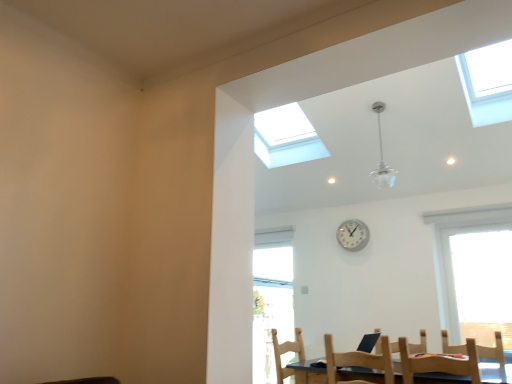
Question: From a real-world perspective, is wooden chair at lower right, positioned as the second chair in right-to-left order, located higher than white plastic clock at center?

Choices:
 (A) yes
 (B) no

Answer: (B)

Question: From the image's perspective, would you say wooden chair at lower right, acting as the second chair starting from the left, is positioned over white plastic clock at center?

Choices:
 (A) yes
 (B) no

Answer: (B)

Question: Is white plastic clock at center located within wooden chair at lower right, positioned as the second chair in right-to-left order?

Choices:
 (A) yes
 (B) no

Answer: (B)

Question: From the image's perspective, would you say wooden chair at lower right, acting as the second chair starting from the left, is shown under white plastic clock at center?

Choices:
 (A) no
 (B) yes

Answer: (B)

Question: Is wooden chair at lower right, positioned as the second chair in right-to-left order, closer to camera compared to white plastic clock at center?

Choices:
 (A) no
 (B) yes

Answer: (B)

Question: Is wooden chair at lower right, acting as the second chair starting from the left, smaller than white plastic clock at center?

Choices:
 (A) yes
 (B) no

Answer: (B)

Question: From the image's perspective, is wooden chair at lower right, acting as the first chair starting from the right, below transparent glass window at upper right, the second window from the back?

Choices:
 (A) yes
 (B) no

Answer: (A)

Question: Is wooden chair at lower right, acting as the first chair starting from the right, oriented towards transparent glass window at upper right, which ranks as the second window in left-to-right order?

Choices:
 (A) yes
 (B) no

Answer: (B)

Question: Does wooden chair at lower right, acting as the first chair starting from the right, have a greater width compared to transparent glass window at upper right, the second window from the back?

Choices:
 (A) no
 (B) yes

Answer: (B)

Question: Considering the relative positions of wooden chair at lower right, which is counted as the 3th chair, starting from the left, and transparent glass window at upper right, the first window positioned from the front, in the image provided, is wooden chair at lower right, which is counted as the 3th chair, starting from the left, to the right of transparent glass window at upper right, the first window positioned from the front, from the viewer's perspective?

Choices:
 (A) yes
 (B) no

Answer: (B)

Question: Can you confirm if wooden chair at lower right, acting as the first chair starting from the right, is positioned to the left of transparent glass window at upper right, which ranks as the second window in left-to-right order?

Choices:
 (A) no
 (B) yes

Answer: (B)

Question: Considering the relative sizes of wooden chair at lower right, which is counted as the 3th chair, starting from the left, and transparent glass window at upper right, the second window from the back, in the image provided, is wooden chair at lower right, which is counted as the 3th chair, starting from the left, shorter than transparent glass window at upper right, the second window from the back,?

Choices:
 (A) no
 (B) yes

Answer: (B)

Question: Does clear glass chandelier at upper center appear on the right side of transparent glass window at upper right, the first window positioned from the front?

Choices:
 (A) no
 (B) yes

Answer: (A)